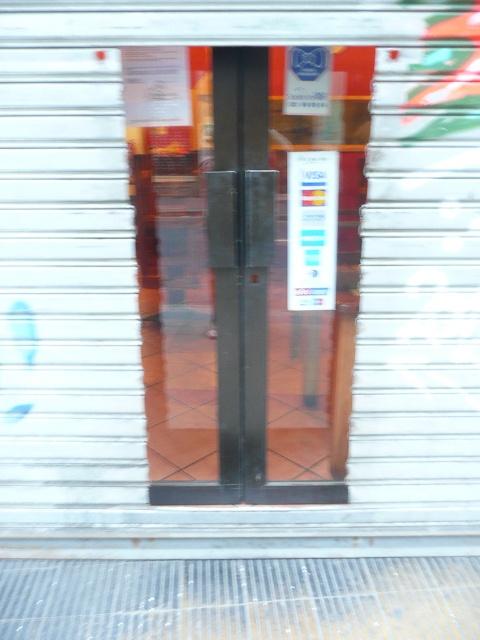
Question: Which point is closer to the camera?

Choices:
 (A) (289, 188)
 (B) (158, 378)

Answer: (A)

Question: Does transparent glass door at center have a larger size compared to white paper at center?

Choices:
 (A) yes
 (B) no

Answer: (A)

Question: Is transparent glass door at center below white paper at center?

Choices:
 (A) yes
 (B) no

Answer: (A)

Question: Which object is closer to the camera taking this photo?

Choices:
 (A) transparent glass door at center
 (B) white paper at center

Answer: (A)

Question: Is transparent glass door at center in front of white paper at center?

Choices:
 (A) no
 (B) yes

Answer: (B)